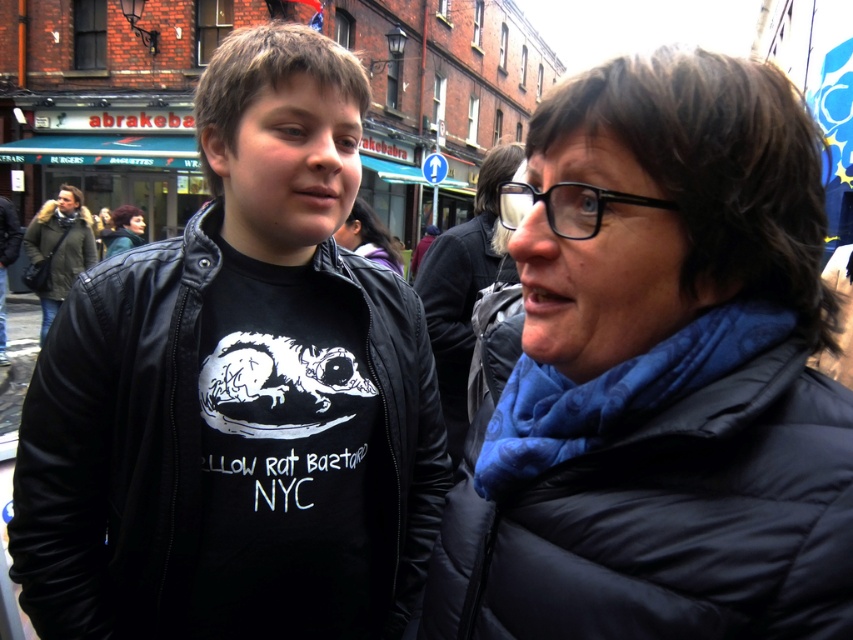
You are a photographer trying to capture a candid shot of the two people in the scene. You want to ensure that both the matte black jacket at center and the dark brown hair at center are clearly visible in your photo. Based on their positions, which object should you focus on first to ensure both are in focus?

The matte black jacket at center is located below dark brown hair at center. Since the dark brown hair at center is above the matte black jacket at center, focusing on the dark brown hair at center first would ensure both are in focus as they are vertically aligned.

You are a fashion designer observing two people in an urban setting. You need to determine which jacket is narrower between the black puffy jacket at right and the green fuzzy coat at left. Which one should you choose?

The black puffy jacket at right has a lesser width compared to the green fuzzy coat at left, so you should choose the black puffy jacket at right as it is narrower.

You are a photographer standing between the black puffy jacket at right and the green fuzzy coat at left. You want to take a photo of both subjects in the same frame. Given that your camera has a maximum focal length that allows capturing objects up to 10 meters apart, will you be able to include both in the photo?

The black puffy jacket at right and green fuzzy coat at left are 9.39 meters apart, which is within the camera maximum focal length of 10 meters. Therefore, you can include both in the photo.